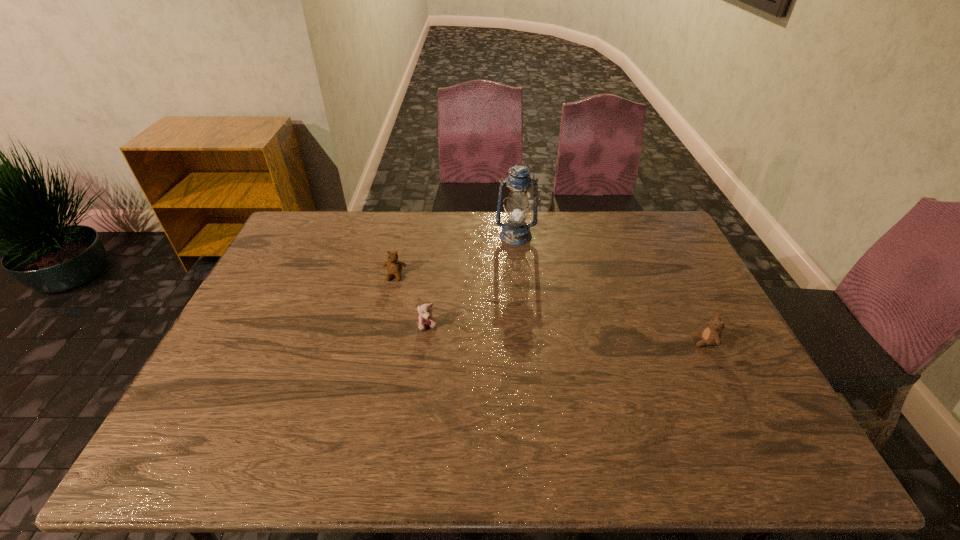
Locate an element on the screen. The image size is (960, 540). vacant point located between the rightmost teddy bear and the farthest teddy bear is located at coordinates point(549,309).

The height and width of the screenshot is (540, 960). I want to click on vacant point located between the farthest object and the second object from left to right, so click(472, 281).

The image size is (960, 540). Identify the location of unoccupied position between the farthest teddy bear and the rightmost teddy bear. (549, 309).

Find the location of a particular element. free space between the second teddy bear from right to left and the rightmost object is located at coordinates (566, 334).

What are the coordinates of `vacant area that lies between the rightmost object and the second teddy bear from right to left` in the screenshot? It's located at pos(566,334).

Find the location of `free space between the rightmost object and the second object from right to left`. free space between the rightmost object and the second object from right to left is located at coordinates (610, 289).

The height and width of the screenshot is (540, 960). I want to click on empty space that is in between the farthest object and the second object from left to right, so [472, 281].

The image size is (960, 540). Find the location of `vacant space in between the third object from left to right and the second teddy bear from left to right`. vacant space in between the third object from left to right and the second teddy bear from left to right is located at coordinates (472, 281).

Identify the location of unoccupied area between the leftmost teddy bear and the tallest object. (455, 256).

Choose which object is the second nearest neighbor to the rightmost teddy bear. Please provide its 2D coordinates. Your answer should be formatted as a tuple, i.e. [(x, y)], where the tuple contains the x and y coordinates of a point satisfying the conditions above.

[(426, 318)]